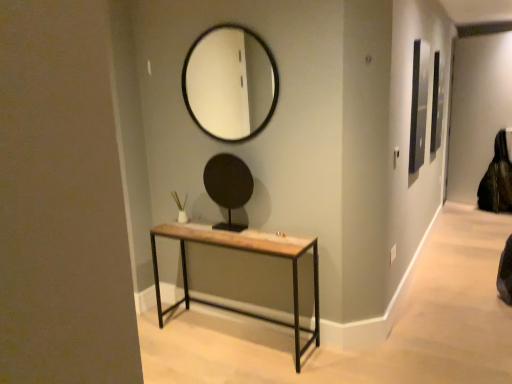
Question: Is black leather swivel chair at right to the left or to the right of rustic wood table at center in the image?

Choices:
 (A) left
 (B) right

Answer: (B)

Question: Based on their sizes in the image, would you say black leather swivel chair at right is bigger or smaller than rustic wood table at center?

Choices:
 (A) big
 (B) small

Answer: (B)

Question: Which object is the closest to the black leather swivel chair at right?

Choices:
 (A) rustic wood table at center
 (B) black glass mirror at upper center, which appears as the 2th mirror when ordered from the bottom
 (C) black matte mirror at center, which appears as the 2th mirror when viewed from the top

Answer: (B)

Question: Which object is positioned farthest from the black glass mirror at upper center, the first mirror from the top?

Choices:
 (A) black leather swivel chair at right
 (B) rustic wood table at center
 (C) black matte mirror at center, which appears as the 2th mirror when viewed from the top

Answer: (A)